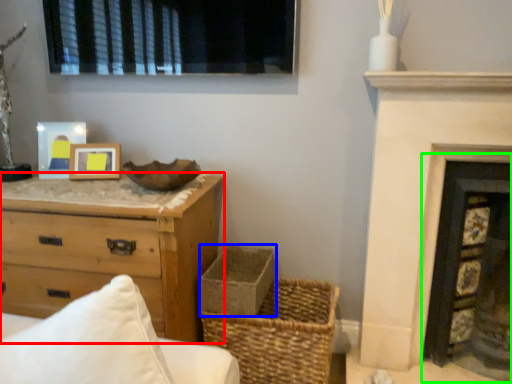
Question: Based on their relative distances, which object is farther from chest of drawers (highlighted by a red box)? Choose from basket container (highlighted by a blue box) and fireplace (highlighted by a green box).

Choices:
 (A) basket container
 (B) fireplace

Answer: (B)